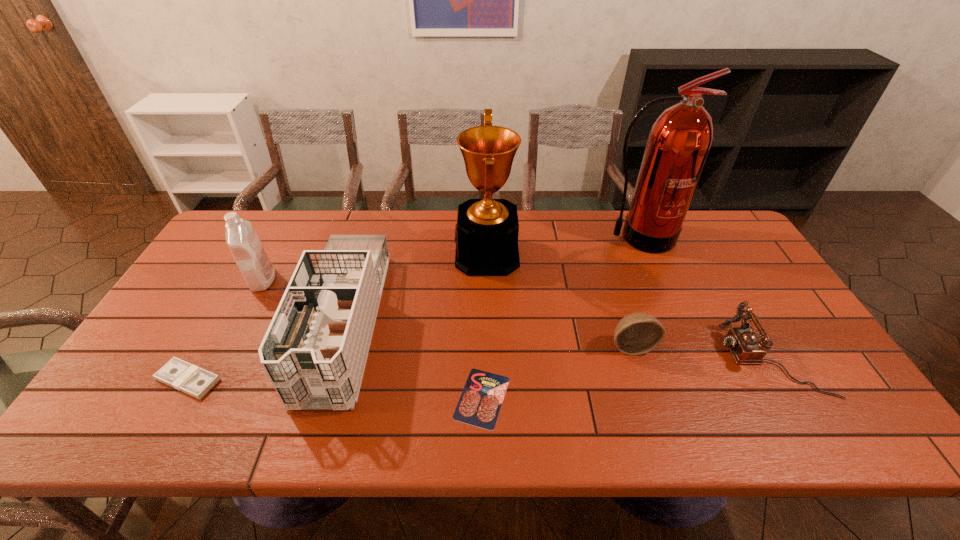
Identify the location of unoccupied position between the third shortest object and the bowl. (x=702, y=352).

Choose which object is the third nearest neighbor to the seventh shortest object. Please provide its 2D coordinates. Your answer should be formatted as a tuple, i.e. [(x, y)], where the tuple contains the x and y coordinates of a point satisfying the conditions above.

[(479, 405)]

Identify which object is located as the fourth nearest to the second shortest object. Please provide its 2D coordinates. Your answer should be formatted as a tuple, i.e. [(x, y)], where the tuple contains the x and y coordinates of a point satisfying the conditions above.

[(486, 235)]

Where is `free space that satisfies the following two spatial constraints: 1. at the entrance of the bowl; 2. on the left side of the dollhouse`? free space that satisfies the following two spatial constraints: 1. at the entrance of the bowl; 2. on the left side of the dollhouse is located at coordinates (337, 346).